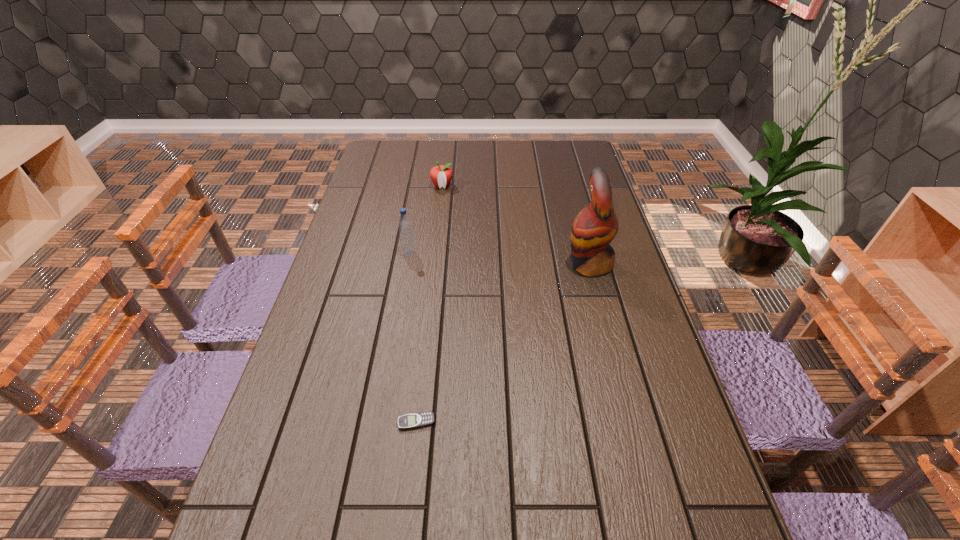
Point out which object is positioned as the third nearest to the nearest object. Please provide its 2D coordinates. Your answer should be formatted as a tuple, i.e. [(x, y)], where the tuple contains the x and y coordinates of a point satisfying the conditions above.

[(441, 175)]

At what (x,y) coordinates should I click in order to perform the action: click on vacant area in the image that satisfies the following two spatial constraints: 1. on the face of the parrot; 2. on the front side of the shortest object. Please return your answer as a coordinate pair (x, y). This screenshot has height=540, width=960. Looking at the image, I should click on (631, 422).